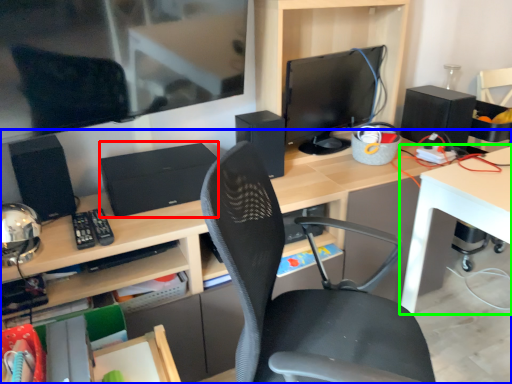
Question: Which object is positioned closest to computer (highlighted by a red box)? Select from desk (highlighted by a blue box) and table (highlighted by a green box).

Choices:
 (A) desk
 (B) table

Answer: (A)